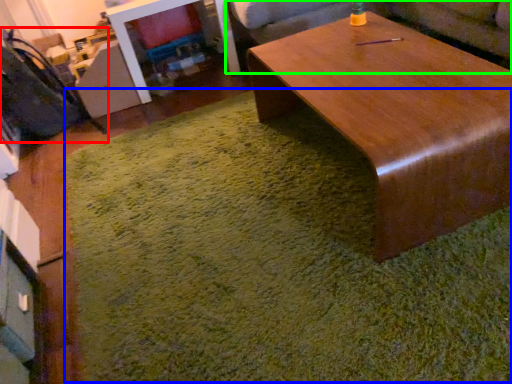
Question: Which object is the farthest from swivel chair (highlighted by a red box)? Choose among these: mat (highlighted by a blue box) or couch (highlighted by a green box).

Choices:
 (A) mat
 (B) couch

Answer: (B)